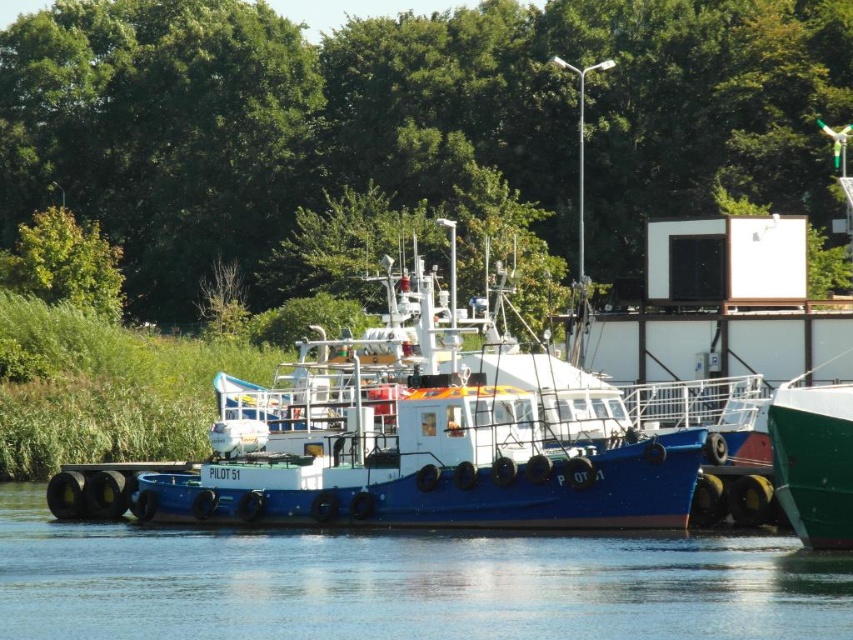
You are standing at the origin point of the coordinate system. You want to move towards the blue matte tugboat at center. What direction should you move in?

Since the blue matte tugboat at center is located at coordinate point (x=393, y=444), you should move towards the right and slightly forward to reach it.

You are standing on the pier where the large blue tugboat named PILOT 51 is docked. You notice a point marked at coordinates [407,120]. What object is located at that point?

The green leafy tree at upper center is located at point [407,120].